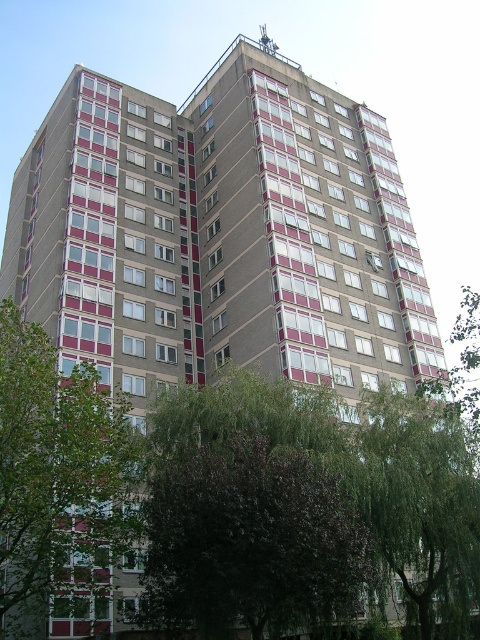
Question: Does dark purple leafy tree at center have a smaller size compared to green leafy tree at left?

Choices:
 (A) no
 (B) yes

Answer: (B)

Question: Which point is closer to the camera?

Choices:
 (A) (130, 451)
 (B) (207, 634)
 (C) (436, 426)

Answer: (B)

Question: Which of the following is the closest to the observer?

Choices:
 (A) green leafy tree at left
 (B) dark purple leafy tree at center
 (C) green leafy tree at lower right

Answer: (B)

Question: Which object is positioned closest to the green leafy tree at lower right?

Choices:
 (A) green leafy tree at left
 (B) dark purple leafy tree at center

Answer: (B)

Question: Is dark purple leafy tree at center positioned at the back of green leafy tree at lower right?

Choices:
 (A) no
 (B) yes

Answer: (A)

Question: Is green leafy tree at left below green leafy tree at lower right?

Choices:
 (A) no
 (B) yes

Answer: (A)